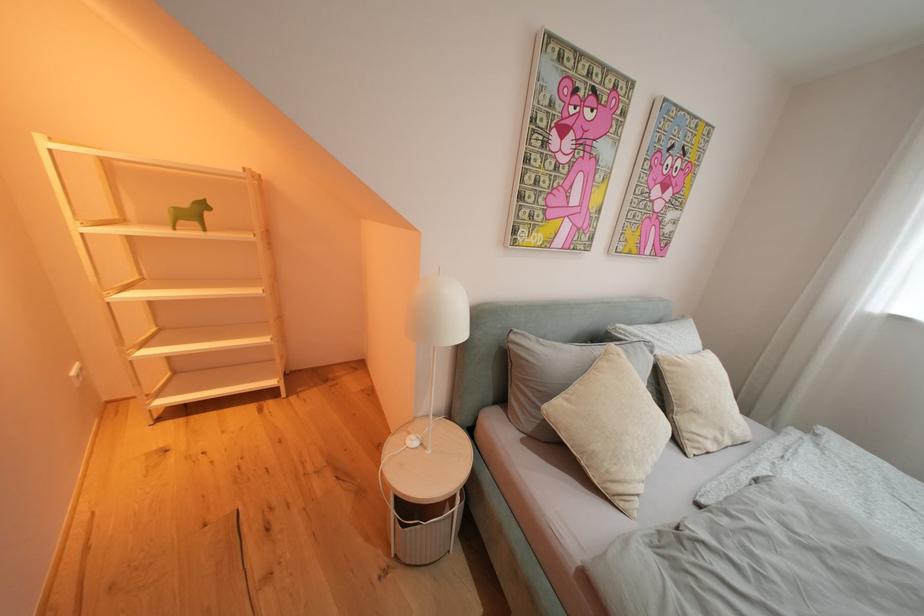
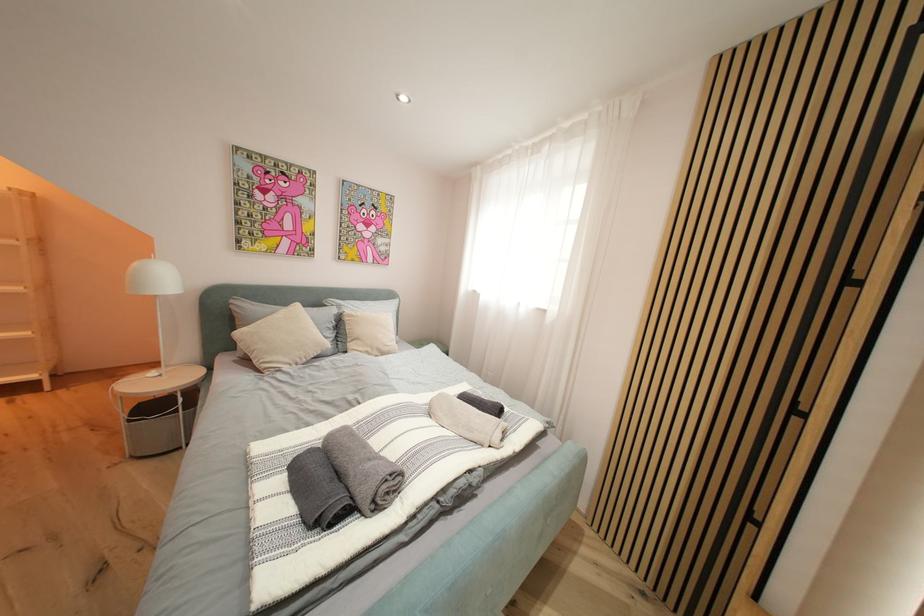
What movement of the cameraman would produce the second image?

The movement direction of the cameraman is right, backward.